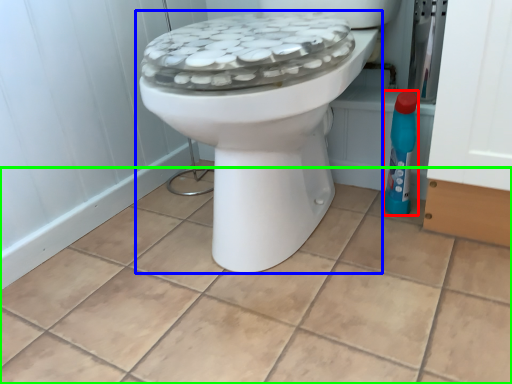
Question: Based on their relative distances, which object is farther from cleaning product (highlighted by a red box)? Choose from toilet (highlighted by a blue box) and ceramic tile (highlighted by a green box).

Choices:
 (A) toilet
 (B) ceramic tile

Answer: (B)